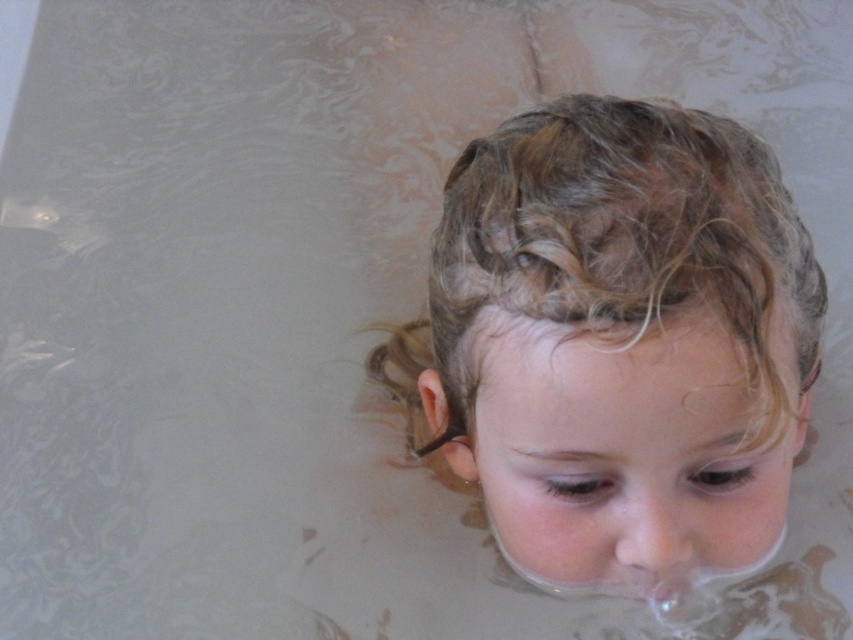
Is curly blonde hair at center above smooth skin nose at center?

Yes.

This screenshot has height=640, width=853. What do you see at coordinates (614, 330) in the screenshot?
I see `curly blonde hair at center` at bounding box center [614, 330].

Where is `curly blonde hair at center`? curly blonde hair at center is located at coordinates (614, 330).